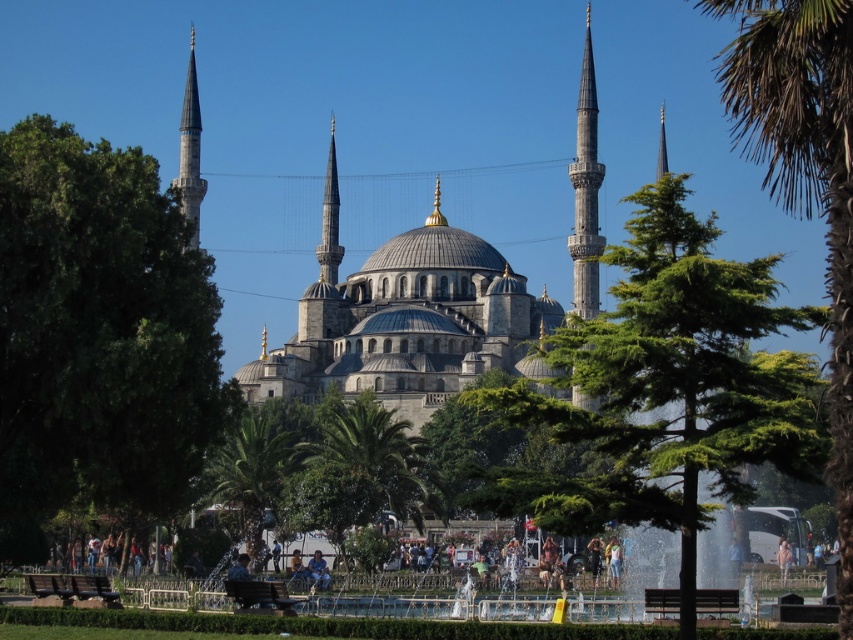
Question: Which object is farther from the camera taking this photo?

Choices:
 (A) green leafy palm tree at center
 (B) dark brown wooden bench at lower center

Answer: (A)

Question: Considering the real-world distances, which object is closest to the green leafy tree at left?

Choices:
 (A) green leafy palm tree at lower center
 (B) wooden park bench at lower center
 (C) green textured tree at center
 (D) green leafy palm tree at center

Answer: (A)

Question: Which of the following is the closest to the observer?

Choices:
 (A) green leafy tree at left
 (B) dark brown wooden bench at lower center

Answer: (B)

Question: Can you confirm if green leafy palm tree at lower center is smaller than dark brown wooden bench at lower center?

Choices:
 (A) yes
 (B) no

Answer: (B)

Question: Is green leafy tree at left wider than wooden park bench at lower center?

Choices:
 (A) no
 (B) yes

Answer: (B)

Question: Is green textured tree at center further to the viewer compared to green leafy tree at center?

Choices:
 (A) no
 (B) yes

Answer: (B)